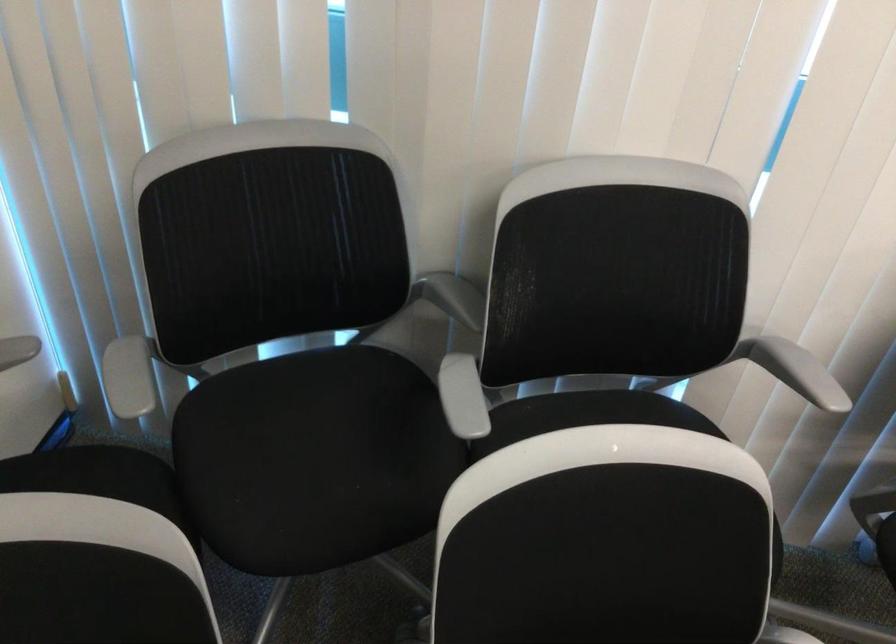
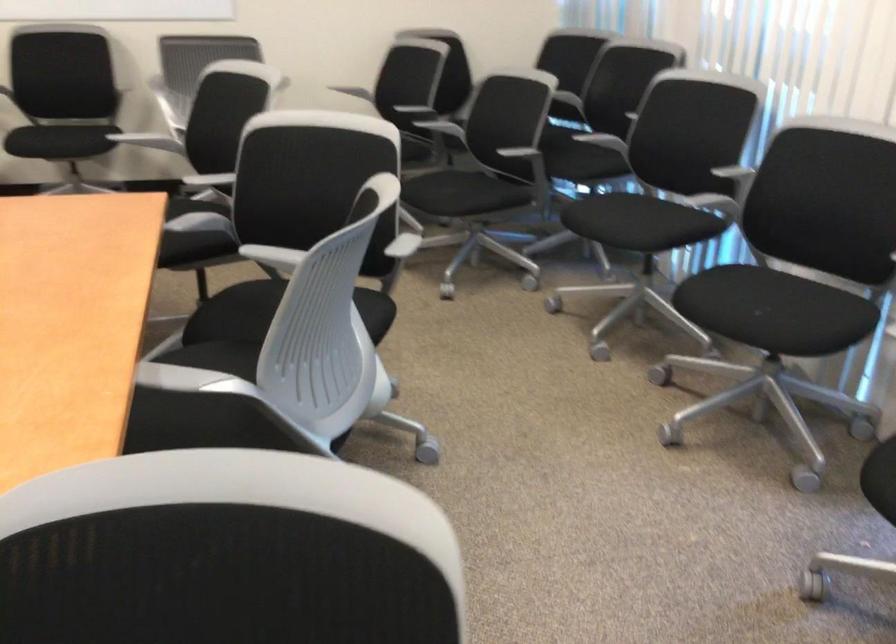
Question: I am providing you with two images of the same scene from different viewpoints. Which of the following objects are not visible in image2?

Choices:
 (A) black wardrobe flap
 (B) black chair sitting surface
 (C) chair sitting surface
 (D) white chair armrest

Answer: (B)